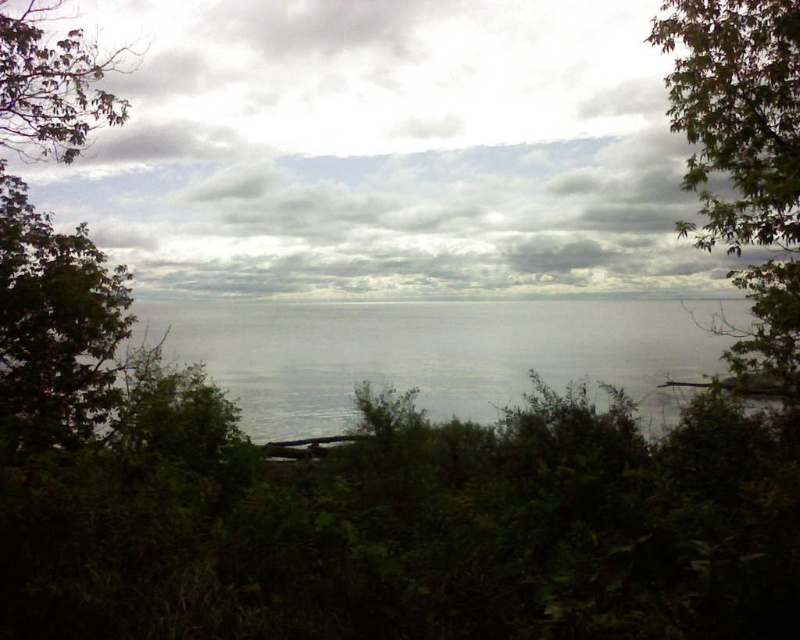
Can you confirm if green leafy shrubs at lower center is wider than green leafy tree at upper right?

Indeed, green leafy shrubs at lower center has a greater width compared to green leafy tree at upper right.

Looking at this image, can you confirm if green leafy shrubs at lower center is positioned to the left of green leafy tree at upper right?

Indeed, green leafy shrubs at lower center is positioned on the left side of green leafy tree at upper right.

At what (x,y) coordinates should I click in order to perform the action: click on green leafy shrubs at lower center. Please return your answer as a coordinate pair (x, y). The image size is (800, 640). Looking at the image, I should click on (404, 524).

Is green leafy shrubs at lower center further to the viewer compared to cloudy sky at center?

No.

The image size is (800, 640). I want to click on green leafy shrubs at lower center, so click(404, 524).

Can you confirm if cloudy sky at center is positioned to the left of transparent water at center?

Correct, you'll find cloudy sky at center to the left of transparent water at center.

Find the location of `cloudy sky at center`. cloudy sky at center is located at coordinates (384, 148).